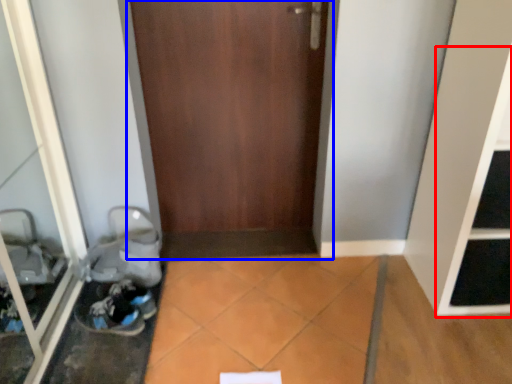
Question: Among these objects, which one is nearest to the camera, shelf (highlighted by a red box) or door (highlighted by a blue box)?

Choices:
 (A) shelf
 (B) door

Answer: (A)